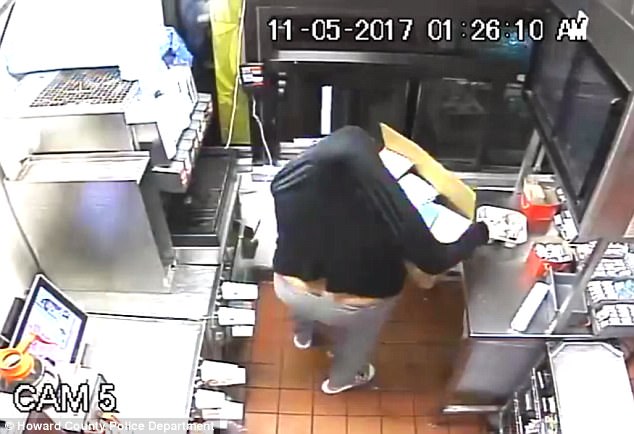
Image resolution: width=634 pixels, height=434 pixels. What are the coordinates of `windows` in the screenshot? It's located at (383, 113), (451, 113), (517, 129).